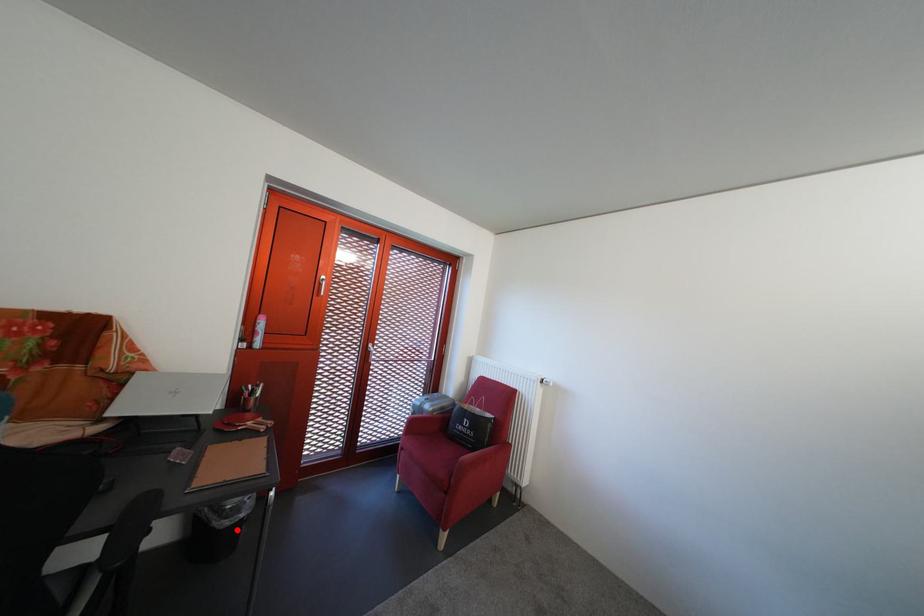
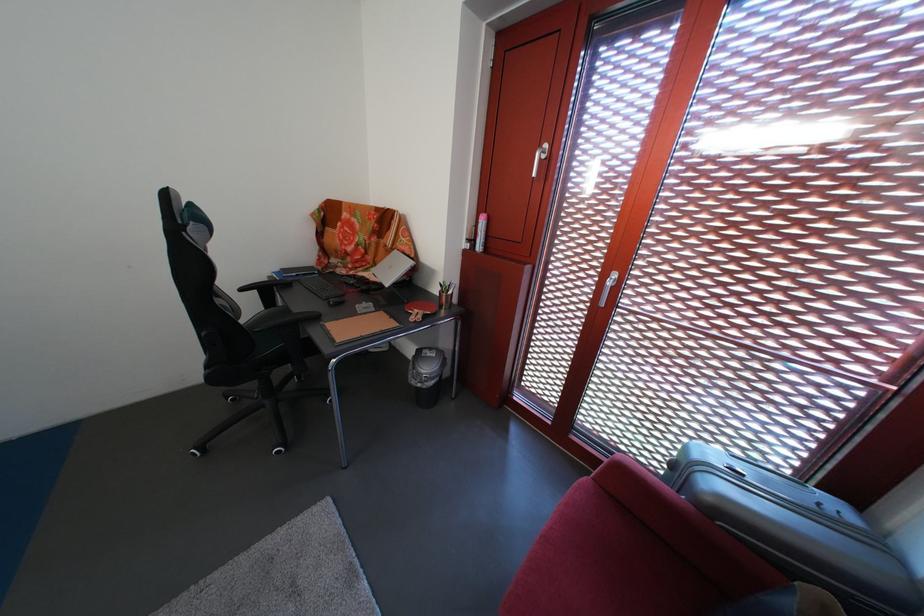
Question: I am providing you with two images of the same scene from different viewpoints. A red point is shown in image1. For the corresponding object point in image2, is it positioned nearer or farther from the camera?

Choices:
 (A) Nearer
 (B) Farther

Answer: (B)